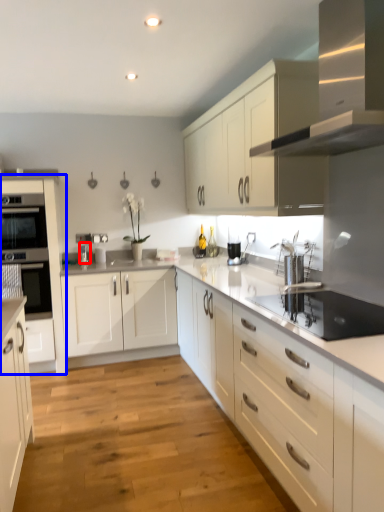
Question: Which object appears closest to the camera in this image, faucet (highlighted by a red box) or cabinetry (highlighted by a blue box)?

Choices:
 (A) faucet
 (B) cabinetry

Answer: (B)